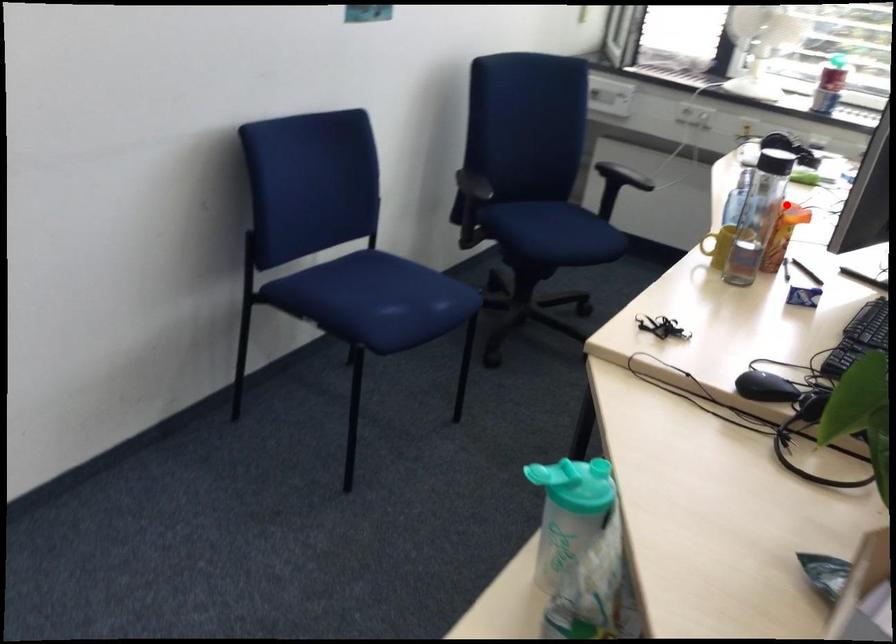
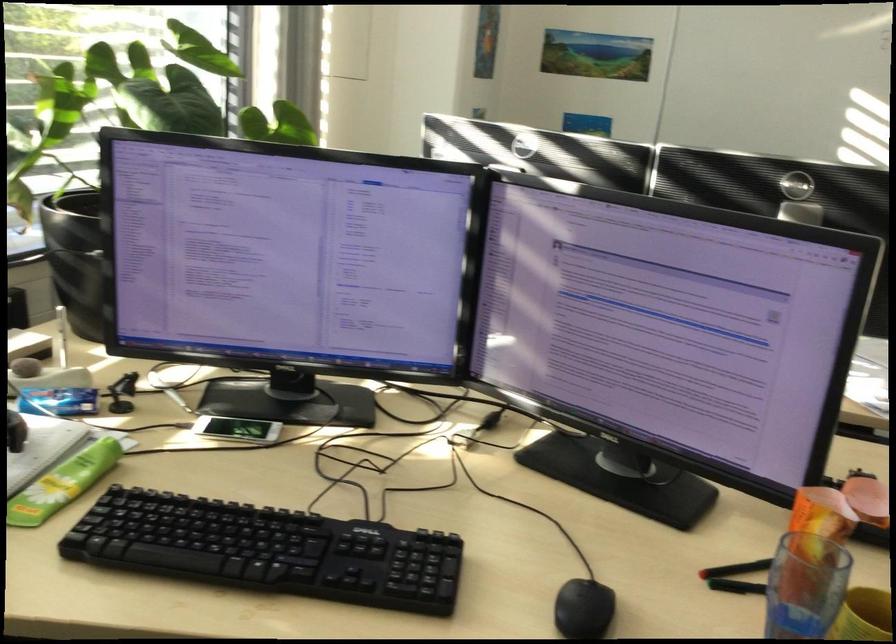
Question: I am providing you with two images of the same scene from different viewpoints. A red point is shown in image1. For the corresponding object point in image2, is it positioned nearer or farther from the camera?

Choices:
 (A) Nearer
 (B) Farther

Answer: (A)